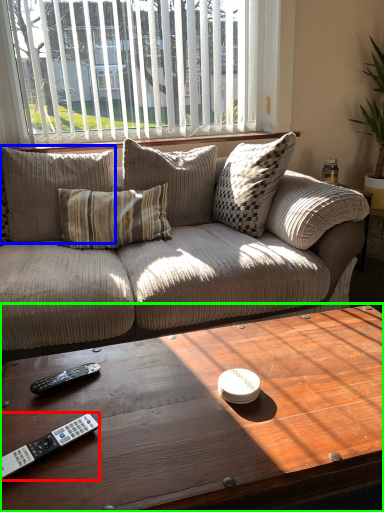
Question: Which is nearer to the remote control (highlighted by a red box)? pillow (highlighted by a blue box) or coffee table (highlighted by a green box).

Choices:
 (A) pillow
 (B) coffee table

Answer: (B)